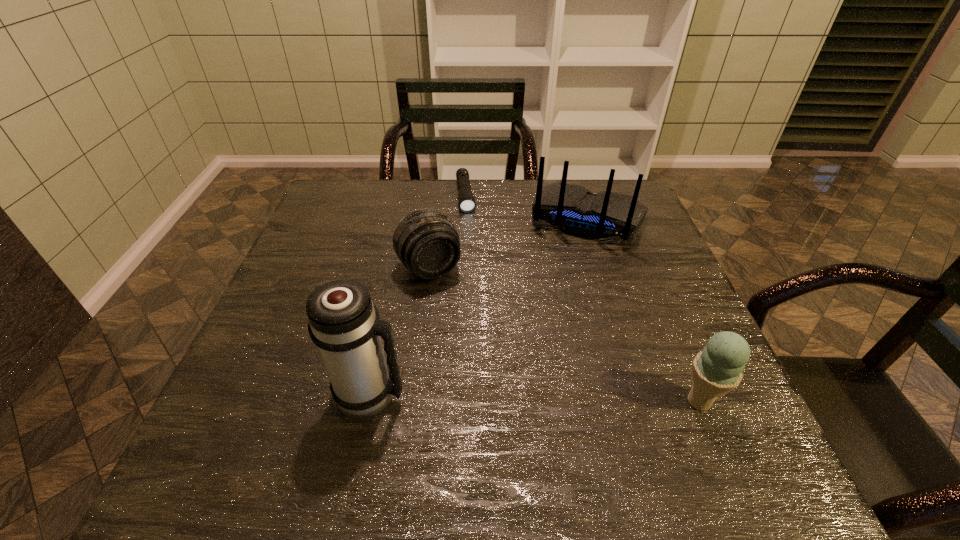
Identify the location of object that is the fourth closest to the second shortest object. Image resolution: width=960 pixels, height=540 pixels. (716, 370).

Choose which object is the fourth nearest neighbor to the tallest object. Please provide its 2D coordinates. Your answer should be formatted as a tuple, i.e. [(x, y)], where the tuple contains the x and y coordinates of a point satisfying the conditions above.

[(466, 199)]